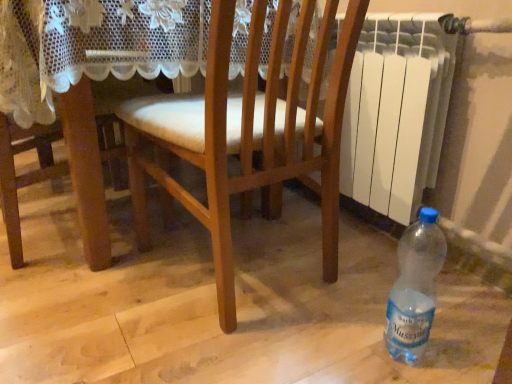
The width and height of the screenshot is (512, 384). I want to click on vacant space in wooden chair at center (from a real-world perspective), so click(246, 282).